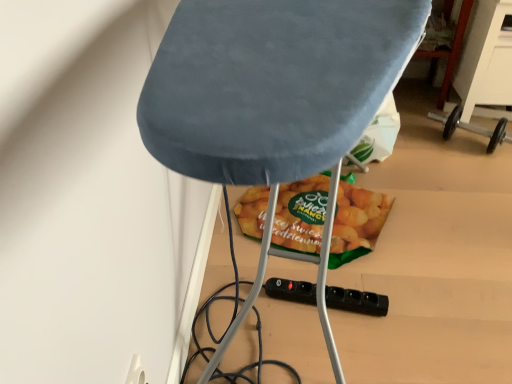
Locate an element on the screen. The image size is (512, 384). free location to the right of black plastic socket at lower center is located at coordinates click(400, 300).